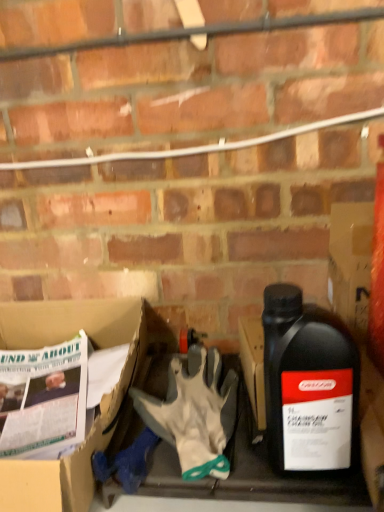
Question: Looking at the image, does white cardboard box at lower left seem bigger or smaller compared to black plastic bottle at right?

Choices:
 (A) big
 (B) small

Answer: (A)

Question: Is point [x=39, y=484] closer or farther from the camera than point [x=311, y=450]?

Choices:
 (A) farther
 (B) closer

Answer: (B)

Question: Which is farther from the black plastic bottle at right?

Choices:
 (A) white cardboard box at lower left
 (B) white fabric glove at center

Answer: (A)

Question: Which object is the farthest from the white cardboard box at lower left?

Choices:
 (A) white fabric glove at center
 (B) black plastic bottle at right

Answer: (B)